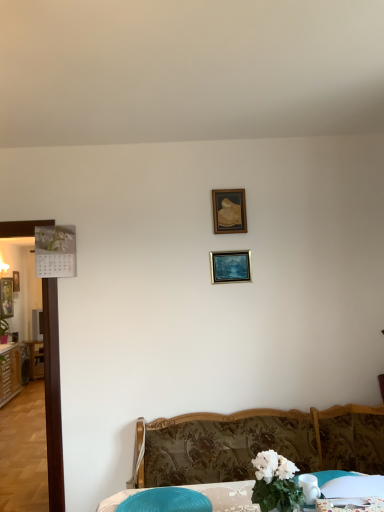
Identify the location of metallic calendar at left, placed as the fourth picture frame when sorted from right to left. (16, 281).

Where is `wooden picture frame at upper center, which appears as the fourth picture frame when ordered from the bottom`? wooden picture frame at upper center, which appears as the fourth picture frame when ordered from the bottom is located at coordinates (229, 211).

Find the location of `metallic silver picture frame at center, the 3th picture frame when ordered from left to right`. metallic silver picture frame at center, the 3th picture frame when ordered from left to right is located at coordinates (230, 266).

From the picture: What is the approximate width of patterned fabric bed at lower center?

The width of patterned fabric bed at lower center is 62.73 centimeters.

This screenshot has height=512, width=384. What do you see at coordinates (166, 501) in the screenshot?
I see `blue plastic swivel chair at lower center` at bounding box center [166, 501].

Find the location of a particular element. The width and height of the screenshot is (384, 512). matte brown dresser at left is located at coordinates (10, 372).

You are a GUI agent. You are given a task and a screenshot of the screen. Output one action in this format:
    pyautogui.click(x=<x>, y=<y>)
    Task: Click on the metallic calendar at left, which ranks as the 4th picture frame in front-to-back order
    Image resolution: width=384 pixels, height=512 pixels.
    Given the screenshot: What is the action you would take?
    pyautogui.click(x=16, y=281)

Consider the image. Is wooden picture frame at upper center, which appears as the 1th picture frame when viewed from the right, at the back of blue plastic swivel chair at lower center?

No, wooden picture frame at upper center, which appears as the 1th picture frame when viewed from the right, is not at the back of blue plastic swivel chair at lower center.

Does blue plastic swivel chair at lower center appear on the left side of wooden picture frame at upper center, which is the first picture frame in top-to-bottom order?

Yes.

Image resolution: width=384 pixels, height=512 pixels. In order to click on swivel chair on the left of wooden picture frame at upper center, which appears as the fourth picture frame when ordered from the bottom in this screenshot , I will do `click(166, 501)`.

Between blue plastic swivel chair at lower center and white lace tablecloth at lower right, which one has larger width?

With larger width is blue plastic swivel chair at lower center.

Is white lace tablecloth at lower right completely or partially inside blue plastic swivel chair at lower center?

Definitely not — white lace tablecloth at lower right is not inside blue plastic swivel chair at lower center.

From the image's perspective, is blue plastic swivel chair at lower center over white lace tablecloth at lower right?

No, from the image's perspective, blue plastic swivel chair at lower center is not on top of white lace tablecloth at lower right.

Between metallic silver picture frame at left, marked as the 4th picture frame in a top-to-bottom arrangement, and white lace tablecloth at lower right, which one is positioned in front?

Positioned in front is white lace tablecloth at lower right.

Does metallic silver picture frame at left, placed as the 2th picture frame when sorted from back to front, have a greater height compared to white lace tablecloth at lower right?

Correct, metallic silver picture frame at left, placed as the 2th picture frame when sorted from back to front, is much taller as white lace tablecloth at lower right.

Would you say metallic silver picture frame at left, which appears as the second picture frame when viewed from the left, is outside white lace tablecloth at lower right?

Yes, metallic silver picture frame at left, which appears as the second picture frame when viewed from the left, is outside of white lace tablecloth at lower right.

Does point (11, 278) appear closer or farther from the camera than point (335, 499)?

Point (11, 278) is farther from the camera than point (335, 499).

Does metallic silver picture frame at left, the 1th picture frame from the bottom, turn towards wooden picture frame at upper center, which appears as the 1th picture frame when viewed from the right?

No, metallic silver picture frame at left, the 1th picture frame from the bottom, is not aimed at wooden picture frame at upper center, which appears as the 1th picture frame when viewed from the right.

Is metallic silver picture frame at left, the 1th picture frame from the bottom, far away from wooden picture frame at upper center, which appears as the 2th picture frame when viewed from the front?

Yes, metallic silver picture frame at left, the 1th picture frame from the bottom, is far from wooden picture frame at upper center, which appears as the 2th picture frame when viewed from the front.

Can you confirm if metallic silver picture frame at left, the third picture frame from the right, is wider than wooden picture frame at upper center, the 3th picture frame in the back-to-front sequence?

Correct, the width of metallic silver picture frame at left, the third picture frame from the right, exceeds that of wooden picture frame at upper center, the 3th picture frame in the back-to-front sequence.

Is point (0, 304) behind point (240, 221)?

Yes.

Does metallic calendar at left, placed as the fourth picture frame when sorted from right to left, have a greater width compared to blue plastic swivel chair at lower center?

No, metallic calendar at left, placed as the fourth picture frame when sorted from right to left, is not wider than blue plastic swivel chair at lower center.

Does metallic calendar at left, which is the 1th picture frame in back-to-front order, contain blue plastic swivel chair at lower center?

No, metallic calendar at left, which is the 1th picture frame in back-to-front order, does not contain blue plastic swivel chair at lower center.

Could you tell me if metallic calendar at left, placed as the fourth picture frame when sorted from right to left, is facing blue plastic swivel chair at lower center?

No, metallic calendar at left, placed as the fourth picture frame when sorted from right to left, is not facing towards blue plastic swivel chair at lower center.

Is metallic calendar at left, which ranks as the 4th picture frame in front-to-back order, closer to the viewer compared to blue plastic swivel chair at lower center?

No.

Is metallic silver picture frame at left, marked as the 4th picture frame in a top-to-bottom arrangement, oriented towards green leafy plant at left?

No.

Does metallic silver picture frame at left, which is the third picture frame in front-to-back order, have a smaller size compared to green leafy plant at left?

No.

Measure the distance between metallic silver picture frame at left, the third picture frame from the right, and green leafy plant at left.

27.06 centimeters.

Consider the image. Does metallic silver picture frame at left, which is the third picture frame in front-to-back order, appear on the right side of blue plastic swivel chair at lower center?

In fact, metallic silver picture frame at left, which is the third picture frame in front-to-back order, is to the left of blue plastic swivel chair at lower center.

From a real-world perspective, which object rests below the other?

blue plastic swivel chair at lower center.

From the image's perspective, is metallic silver picture frame at left, placed as the 2th picture frame when sorted from back to front, located above or below blue plastic swivel chair at lower center?

From the image's perspective, metallic silver picture frame at left, placed as the 2th picture frame when sorted from back to front, appears above blue plastic swivel chair at lower center.

In the scene shown: Considering the sizes of objects metallic silver picture frame at left, the 1th picture frame from the bottom, and blue plastic swivel chair at lower center in the image provided, who is wider, metallic silver picture frame at left, the 1th picture frame from the bottom, or blue plastic swivel chair at lower center?

blue plastic swivel chair at lower center is wider.

Where is `swivel chair lying on the left of wooden picture frame at upper center, the 3th picture frame in the back-to-front sequence`? Image resolution: width=384 pixels, height=512 pixels. swivel chair lying on the left of wooden picture frame at upper center, the 3th picture frame in the back-to-front sequence is located at coordinates (166, 501).

Find the location of `swivel chair behind the white lace tablecloth at lower right`. swivel chair behind the white lace tablecloth at lower right is located at coordinates (166, 501).

Considering their positions, is matte brown dresser at left positioned further to metallic calendar at left, placed as the second picture frame when sorted from bottom to top, than wooden picture frame at upper center, which is the first picture frame in top-to-bottom order?

Among the two, wooden picture frame at upper center, which is the first picture frame in top-to-bottom order, is located further to metallic calendar at left, placed as the second picture frame when sorted from bottom to top.

Based on their spatial positions, is matte brown dresser at left or green leafy plant at left further from blue plastic swivel chair at lower center?

green leafy plant at left.

When comparing their distances from metallic silver picture frame at left, which is the third picture frame in front-to-back order, does green leafy plant at left or metallic calendar at left, placed as the second picture frame when sorted from bottom to top, seem closer?

metallic calendar at left, placed as the second picture frame when sorted from bottom to top.

When comparing their distances from wooden picture frame at upper center, which ranks as the 4th picture frame in left-to-right order, does metallic silver picture frame at left, the 1th picture frame from the bottom, or white lace tablecloth at lower right seem closer?

Based on the image, white lace tablecloth at lower right appears to be nearer to wooden picture frame at upper center, which ranks as the 4th picture frame in left-to-right order.

Looking at the image, which one is located further to metallic calendar at left, which ranks as the 4th picture frame in front-to-back order, matte brown dresser at left or metallic silver picture frame at left, the third picture frame from the right?

Among the two, matte brown dresser at left is located further to metallic calendar at left, which ranks as the 4th picture frame in front-to-back order.

Looking at the image, which one is located further to blue plastic swivel chair at lower center, metallic silver picture frame at center, placed as the 2th picture frame when sorted from top to bottom, or wooden picture frame at upper center, the 3th picture frame in the back-to-front sequence?

Among the two, wooden picture frame at upper center, the 3th picture frame in the back-to-front sequence, is located further to blue plastic swivel chair at lower center.

Estimate the real-world distances between objects in this image. Which object is further from matte brown dresser at left, metallic silver picture frame at left, the third picture frame from the right, or patterned fabric bed at lower center?

Among the two, patterned fabric bed at lower center is located further to matte brown dresser at left.

Based on their spatial positions, is blue plastic swivel chair at lower center or green leafy plant at left further from wooden picture frame at upper center, which appears as the 1th picture frame when viewed from the right?

green leafy plant at left.

Identify the location of picture frame between white lace tablecloth at lower right and wooden picture frame at upper center, the 3th picture frame in the back-to-front sequence, from front to back. Image resolution: width=384 pixels, height=512 pixels. (230, 266).

Where is `swivel chair between white lace tablecloth at lower right and matte brown dresser at left from front to back`? swivel chair between white lace tablecloth at lower right and matte brown dresser at left from front to back is located at coordinates click(166, 501).

Where is `plant located between white lace tablecloth at lower right and metallic silver picture frame at left, marked as the 4th picture frame in a top-to-bottom arrangement, in the depth direction`? This screenshot has width=384, height=512. plant located between white lace tablecloth at lower right and metallic silver picture frame at left, marked as the 4th picture frame in a top-to-bottom arrangement, in the depth direction is located at coordinates (3, 330).

Where is `swivel chair positioned between white lace tablecloth at lower right and metallic silver picture frame at left, the 1th picture frame from the bottom, from near to far`? swivel chair positioned between white lace tablecloth at lower right and metallic silver picture frame at left, the 1th picture frame from the bottom, from near to far is located at coordinates (166, 501).